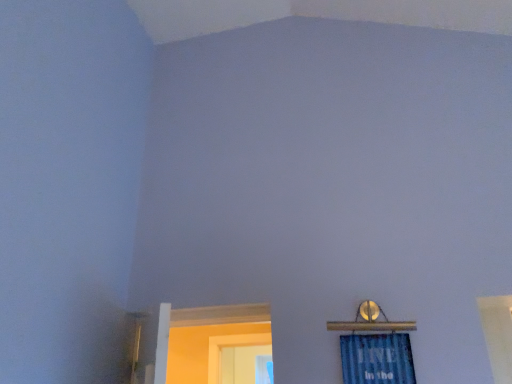
This screenshot has width=512, height=384. In order to click on blue fabric curtain at lower right in this screenshot , I will do `click(377, 359)`.

Describe the element at coordinates (377, 359) in the screenshot. I see `blue fabric curtain at lower right` at that location.

What is the approximate height of blue fabric curtain at lower right?

blue fabric curtain at lower right is 36.64 centimeters tall.

This screenshot has height=384, width=512. Find the location of `blue fabric curtain at lower right`. blue fabric curtain at lower right is located at coordinates (377, 359).